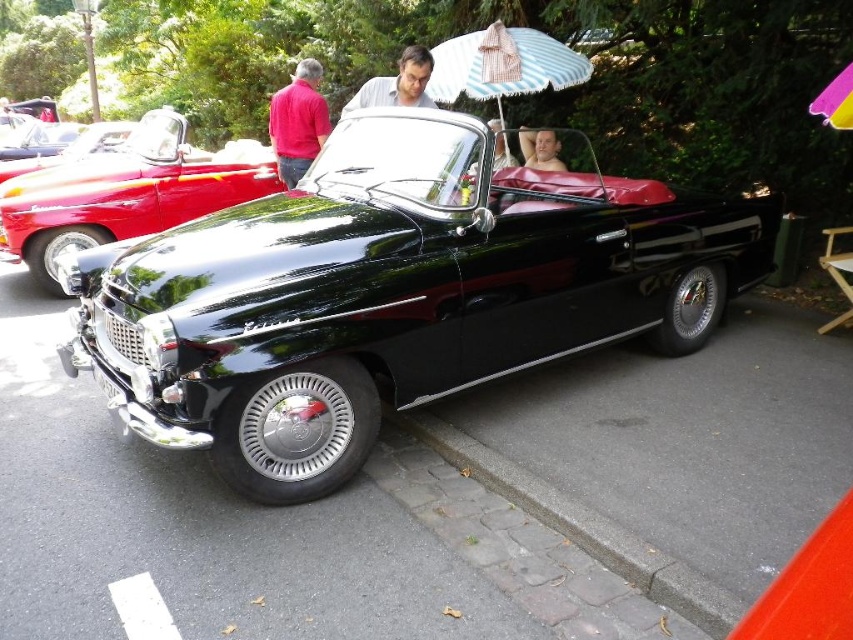
You are a photographer positioned at the edge of the paved area where the vintage convertible is parked. You want to capture a shot of the car while ensuring the brown cobblestone curb at lower center is visible in the frame. Based on its position, where should you aim your camera to include both the car and the curb?

The brown cobblestone curb at lower center is located at point (581,525), so to include both the car and the curb in the frame, aim your camera towards the lower center area where the curb is positioned while ensuring the car remains in view.

You are a photographer standing at the edge of the paved area where the vintage convertible is parked. You want to take a photo that includes both the brown cobblestone curb at lower center and the smooth gray shirt at center. Based on their distance, will you need to adjust your camera angle to capture both in the frame?

The brown cobblestone curb at lower center and the smooth gray shirt at center are 8.95 feet apart. To capture both in the frame, you would need to adjust your camera angle to account for the distance between them.

You are a photographer setting up equipment for a car show. You have a tripod that needs to be placed between the brown cobblestone curb at lower center and the pink fabric umbrella at upper right. Which object is wider so you can position the tripod appropriately?

The brown cobblestone curb at lower center is wider than the pink fabric umbrella at upper right, so you should position the tripod near the brown cobblestone curb at lower center to accommodate its width.